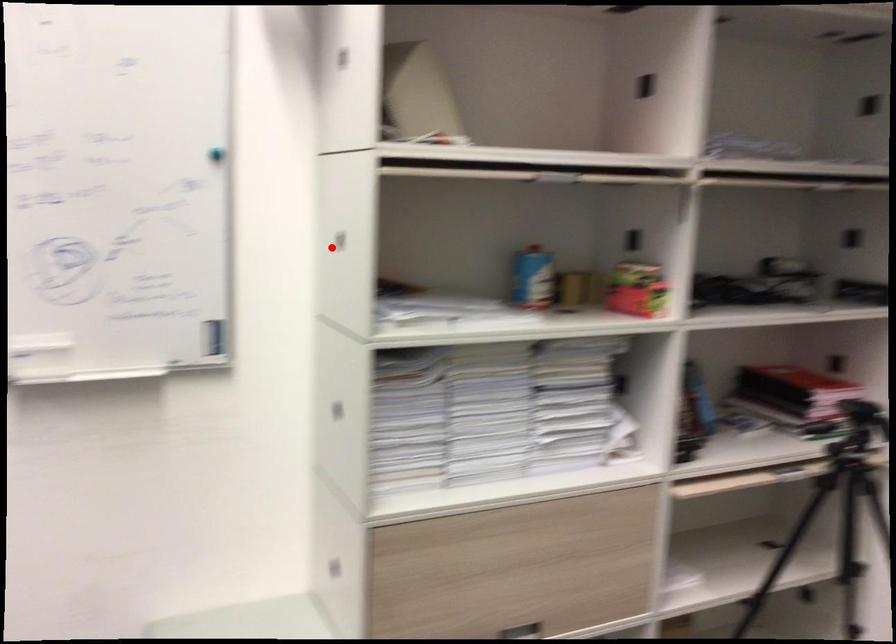
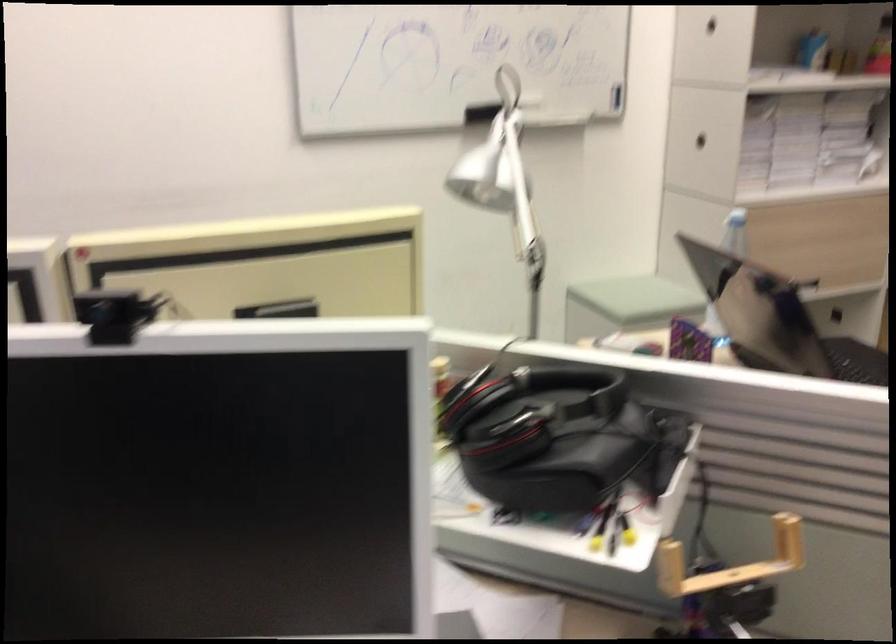
The point at the highlighted location is marked in the first image. Where is the corresponding point in the second image?

(711, 24)